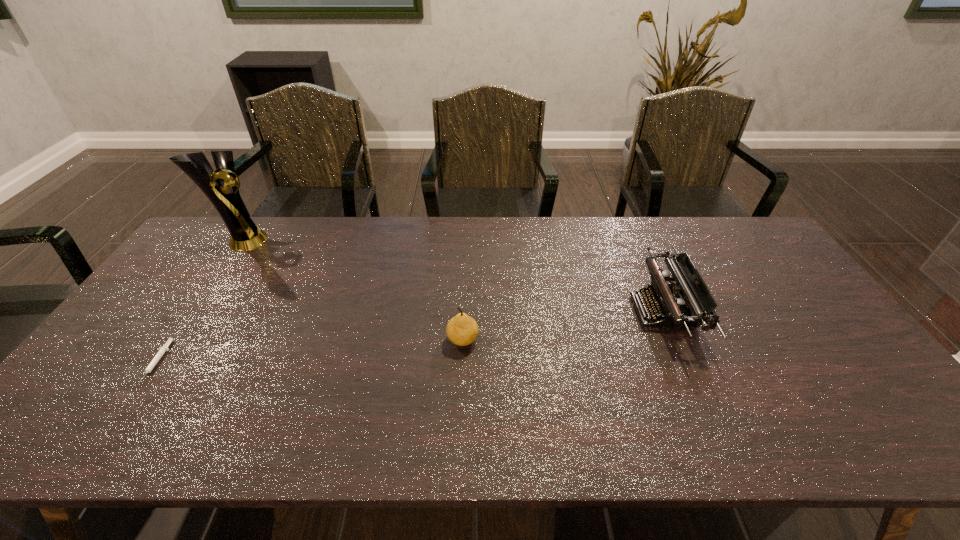
The width and height of the screenshot is (960, 540). Identify the location of blank area located 0.330m on the right of the shortest object. (293, 363).

The image size is (960, 540). Identify the location of object at the far edge. (244, 235).

Image resolution: width=960 pixels, height=540 pixels. Find the location of `award present at the left edge`. award present at the left edge is located at coordinates (244, 235).

Where is `syringe that is at the left edge`? This screenshot has height=540, width=960. syringe that is at the left edge is located at coordinates (162, 350).

Locate an element on the screen. object at the far left corner is located at coordinates (244, 235).

What are the coordinates of `vacant space at the far edge` in the screenshot? It's located at (422, 245).

In the image, there is a desktop. Where is `vacant space at the near edge`? vacant space at the near edge is located at coordinates (407, 446).

In the image, there is a desktop. Where is `blank space at the left edge`? blank space at the left edge is located at coordinates (175, 276).

Identify the location of empty space that is in between the typewriter and the shortest object. (410, 337).

Identify the location of vacant region between the typewriter and the farthest object. (452, 276).